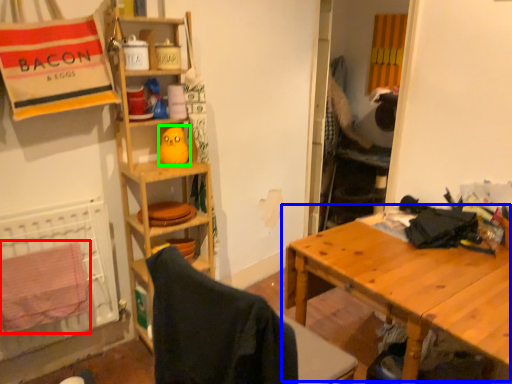
Question: Which object is positioned farthest from beach towel (highlighted by a red box)? Select from table (highlighted by a blue box) and toy (highlighted by a green box).

Choices:
 (A) table
 (B) toy

Answer: (A)